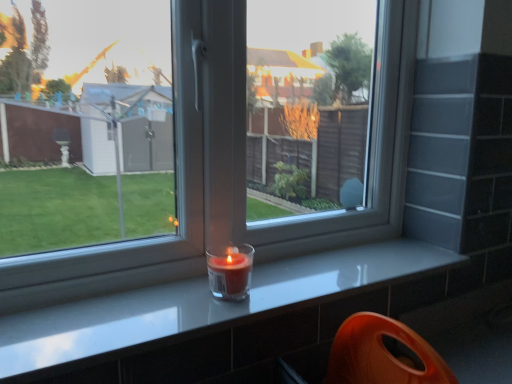
In order to face translucent glass candle at window, should I rotate leftwards or rightwards?

Turn left by 3.164 degrees to look at translucent glass candle at window.

What do you see at coordinates (230, 271) in the screenshot? This screenshot has width=512, height=384. I see `translucent glass candle at window` at bounding box center [230, 271].

What is the approximate height of translucent glass candle at window?

The height of translucent glass candle at window is 3.96 inches.

I want to click on translucent glass candle at window, so click(230, 271).

The width and height of the screenshot is (512, 384). What do you see at coordinates (202, 307) in the screenshot?
I see `smooth gray counter at center` at bounding box center [202, 307].

In order to click on smooth gray counter at center in this screenshot , I will do `click(202, 307)`.

In order to face smooth gray counter at center, should I rotate leftwards or rightwards?

To face it directly, rotate right by 2.811 degrees.

What is the approximate width of smooth gray counter at center?

It is 9.44 inches.

At what (x,y) coordinates should I click in order to perform the action: click on translucent glass candle at window. Please return your answer as a coordinate pair (x, y). Looking at the image, I should click on (230, 271).

Which is more to the left, translucent glass candle at window or smooth gray counter at center?

translucent glass candle at window is more to the left.

Does translucent glass candle at window lie behind smooth gray counter at center?

Yes, translucent glass candle at window is further from the viewer.

Which point is more distant from viewer, (211,289) or (1,374)?

Positioned behind is point (211,289).

From the image's perspective, is translucent glass candle at window over smooth gray counter at center?

Yes, from the image's perspective, translucent glass candle at window is above smooth gray counter at center.

From a real-world perspective, is translucent glass candle at window above or below smooth gray counter at center?

In terms of real-world spatial position, translucent glass candle at window is above smooth gray counter at center.

Which of these two, translucent glass candle at window or smooth gray counter at center, is thinner?

translucent glass candle at window is thinner.

Does translucent glass candle at window have a lesser height compared to smooth gray counter at center?

In fact, translucent glass candle at window may be taller than smooth gray counter at center.

Can you confirm if translucent glass candle at window is bigger than smooth gray counter at center?

No, translucent glass candle at window is not bigger than smooth gray counter at center.

Is translucent glass candle at window completely or partially outside of smooth gray counter at center?

translucent glass candle at window is positioned outside smooth gray counter at center.

Can you see translucent glass candle at window touching smooth gray counter at center?

No, translucent glass candle at window is not in contact with smooth gray counter at center.

Is translucent glass candle at window looking in the opposite direction of smooth gray counter at center?

No, translucent glass candle at window is not facing away from smooth gray counter at center.

Image resolution: width=512 pixels, height=384 pixels. In order to click on counter that is on the right side of translucent glass candle at window in this screenshot , I will do `click(202, 307)`.

Is smooth gray counter at center to the left of translucent glass candle at window from the viewer's perspective?

In fact, smooth gray counter at center is to the right of translucent glass candle at window.

Is smooth gray counter at center in front of or behind translucent glass candle at window in the image?

Visually, smooth gray counter at center is located in front of translucent glass candle at window.

Which is closer, (60, 334) or (241, 259)?

Point (60, 334) appears to be closer to the viewer than point (241, 259).

From the image's perspective, is smooth gray counter at center on top of translucent glass candle at window?

No, from the image's perspective, smooth gray counter at center is not above translucent glass candle at window.

From a real-world perspective, who is located lower, smooth gray counter at center or translucent glass candle at window?

From a 3D spatial view, smooth gray counter at center is below.

Consider the image. Considering the sizes of smooth gray counter at center and translucent glass candle at window in the image, is smooth gray counter at center wider or thinner than translucent glass candle at window?

smooth gray counter at center is wider than translucent glass candle at window.

Can you confirm if smooth gray counter at center is taller than translucent glass candle at window?

No.

Considering the relative sizes of smooth gray counter at center and translucent glass candle at window in the image provided, is smooth gray counter at center bigger than translucent glass candle at window?

Yes, smooth gray counter at center is bigger than translucent glass candle at window.

Can we say smooth gray counter at center lies outside translucent glass candle at window?

Yes, smooth gray counter at center is not within translucent glass candle at window.

Are smooth gray counter at center and translucent glass candle at window located far from each other?

They are positioned close to each other.

Does smooth gray counter at center turn towards translucent glass candle at window?

No, smooth gray counter at center is not turned towards translucent glass candle at window.

Based on the photo, how many degrees apart are the facing directions of smooth gray counter at center and translucent glass candle at window?

smooth gray counter at center and translucent glass candle at window are facing 2.52 degrees away from each other.

Where is `counter that appears below the translucent glass candle at window (from the image's perspective)`? This screenshot has height=384, width=512. counter that appears below the translucent glass candle at window (from the image's perspective) is located at coordinates (202, 307).

In the image, there is a smooth gray counter at center. Where is `candle holder above it (from the image's perspective)`? The height and width of the screenshot is (384, 512). candle holder above it (from the image's perspective) is located at coordinates (230, 271).

Identify the location of candle holder above the smooth gray counter at center (from a real-world perspective). This screenshot has height=384, width=512. (230, 271).